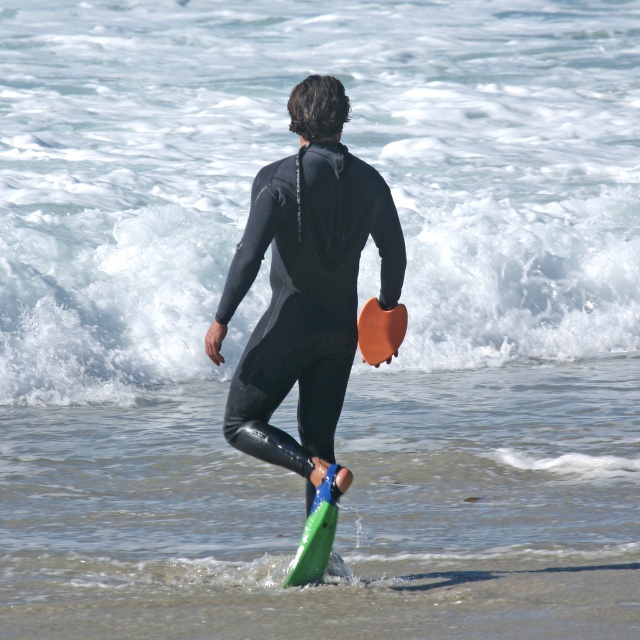
Question: Observing the image, what is the correct spatial positioning of green rubber surfboard at lower center in reference to orange matte surfboard at lower center?

Choices:
 (A) left
 (B) right

Answer: (A)

Question: Which point is farther from the camera taking this photo?

Choices:
 (A) (376, 307)
 (B) (500, 310)
 (C) (284, 278)

Answer: (B)

Question: Which object is positioned farthest from the green rubber surfboard at lower center?

Choices:
 (A) white frothy wave at upper center
 (B) orange matte surfboard at lower center

Answer: (A)

Question: Can you confirm if black matte wetsuit at center is wider than green rubber surfboard at lower center?

Choices:
 (A) no
 (B) yes

Answer: (B)

Question: Which point is closer to the camera?

Choices:
 (A) (372, 364)
 (B) (332, 512)
 (C) (161, 374)

Answer: (B)

Question: Can you confirm if black matte wetsuit at center is positioned to the right of orange matte surfboard at lower center?

Choices:
 (A) yes
 (B) no

Answer: (B)